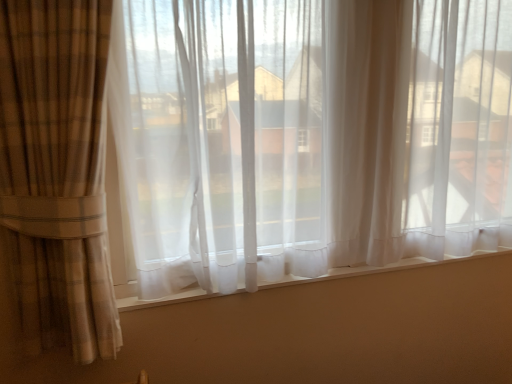
Question: From the image's perspective, is translucent white curtain at center under white sheer curtain at center?

Choices:
 (A) no
 (B) yes

Answer: (A)

Question: Are translucent white curtain at center and white sheer curtain at center far apart?

Choices:
 (A) yes
 (B) no

Answer: (B)

Question: Does translucent white curtain at center have a lesser width compared to white sheer curtain at center?

Choices:
 (A) yes
 (B) no

Answer: (B)

Question: Is translucent white curtain at center not within white sheer curtain at center?

Choices:
 (A) no
 (B) yes

Answer: (B)

Question: Can you confirm if translucent white curtain at center is wider than white sheer curtain at center?

Choices:
 (A) yes
 (B) no

Answer: (A)

Question: From a real-world perspective, is translucent white curtain at center physically below white sheer curtain at center?

Choices:
 (A) yes
 (B) no

Answer: (B)

Question: Is white sheer curtain at center bigger than translucent white curtain at center?

Choices:
 (A) no
 (B) yes

Answer: (A)

Question: Is translucent white curtain at center a part of white sheer curtain at center?

Choices:
 (A) no
 (B) yes

Answer: (A)

Question: Does white sheer curtain at center have a smaller size compared to translucent white curtain at center?

Choices:
 (A) yes
 (B) no

Answer: (A)

Question: From a real-world perspective, does white sheer curtain at center stand above translucent white curtain at center?

Choices:
 (A) no
 (B) yes

Answer: (A)

Question: Is white sheer curtain at center with translucent white curtain at center?

Choices:
 (A) no
 (B) yes

Answer: (A)

Question: Considering the relative positions of white sheer curtain at center and translucent white curtain at center in the image provided, is white sheer curtain at center to the left of translucent white curtain at center from the viewer's perspective?

Choices:
 (A) no
 (B) yes

Answer: (B)

Question: Considering the positions of white sheer curtain at center and translucent white curtain at center in the image, is white sheer curtain at center taller or shorter than translucent white curtain at center?

Choices:
 (A) tall
 (B) short

Answer: (B)